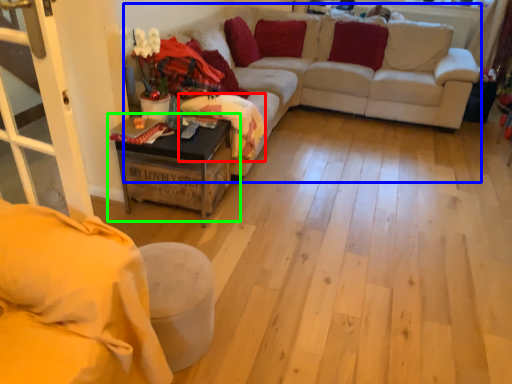
Question: Which object is the closest to the blanket (highlighted by a red box)? Choose among these: couch (highlighted by a blue box) or table (highlighted by a green box).

Choices:
 (A) couch
 (B) table

Answer: (B)